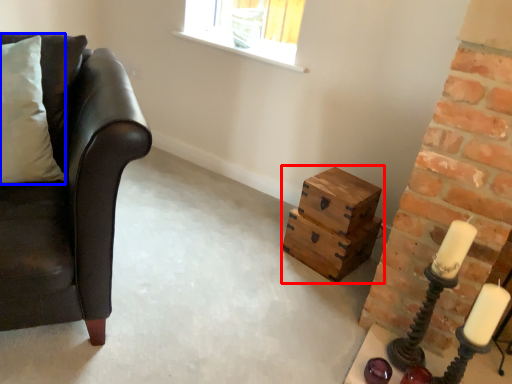
Question: Which of the following is the farthest to the observer, crate (highlighted by a red box) or pillow (highlighted by a blue box)?

Choices:
 (A) crate
 (B) pillow

Answer: (A)